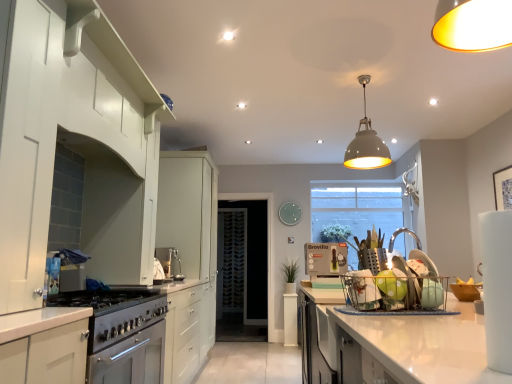
Question: From the image's perspective, is transparent glass door at center over satin silver coffee machine at center, the 5th appliance when ordered from right to left?

Choices:
 (A) yes
 (B) no

Answer: (B)

Question: From the image's perspective, would you say transparent glass door at center is shown under satin silver coffee machine at center, the 5th appliance when ordered from right to left?

Choices:
 (A) no
 (B) yes

Answer: (B)

Question: Is transparent glass door at center in contact with satin silver coffee machine at center, which appears as the 4th appliance when viewed from the front?

Choices:
 (A) no
 (B) yes

Answer: (A)

Question: Is satin silver coffee machine at center, the 2th appliance viewed from the back, a part of transparent glass door at center?

Choices:
 (A) yes
 (B) no

Answer: (B)

Question: Considering the relative sizes of transparent glass door at center and satin silver coffee machine at center, which appears as the 4th appliance when viewed from the front, in the image provided, is transparent glass door at center thinner than satin silver coffee machine at center, which appears as the 4th appliance when viewed from the front,?

Choices:
 (A) no
 (B) yes

Answer: (A)

Question: Considering the positions of white glossy cabinet at lower left, which is the 2th cabinetry in front-to-back order, and green matte apple at center in the image, is white glossy cabinet at lower left, which is the 2th cabinetry in front-to-back order, taller or shorter than green matte apple at center?

Choices:
 (A) short
 (B) tall

Answer: (B)

Question: Would you say white glossy cabinet at lower left, which is the second cabinetry from back to front, is inside or outside green matte apple at center?

Choices:
 (A) inside
 (B) outside

Answer: (B)

Question: From a real-world perspective, relative to green matte apple at center, is white glossy cabinet at lower left, which is the second cabinetry from back to front, vertically above or below?

Choices:
 (A) below
 (B) above

Answer: (A)

Question: From the image's perspective, is white glossy cabinet at lower left, which is the 2th cabinetry in front-to-back order, positioned above or below green matte apple at center?

Choices:
 (A) above
 (B) below

Answer: (B)

Question: Is green plastic kettle at center in front of or behind wooden picture frame at upper right in the image?

Choices:
 (A) behind
 (B) front

Answer: (B)

Question: From the image's perspective, is green plastic kettle at center above or below wooden picture frame at upper right?

Choices:
 (A) below
 (B) above

Answer: (A)

Question: Is point (343, 266) closer or farther from the camera than point (508, 200)?

Choices:
 (A) closer
 (B) farther

Answer: (A)

Question: Which is correct: green plastic kettle at center is inside wooden picture frame at upper right, or outside of it?

Choices:
 (A) outside
 (B) inside

Answer: (A)

Question: Is wooden picture frame at upper right spatially inside clear glass bowl at right, marked as the first appliance in a front-to-back arrangement, or outside of it?

Choices:
 (A) outside
 (B) inside

Answer: (A)

Question: From the image's perspective, is wooden picture frame at upper right located above or below clear glass bowl at right, marked as the first appliance in a front-to-back arrangement?

Choices:
 (A) above
 (B) below

Answer: (A)